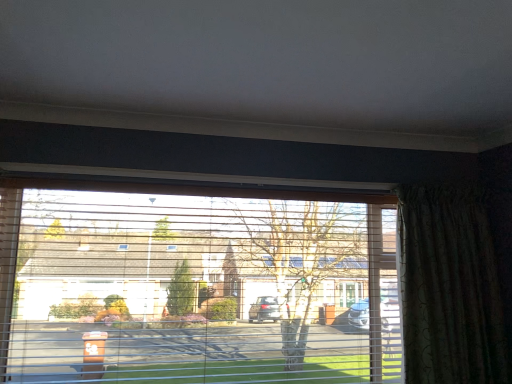
Question: From the image's perspective, is transparent plastic window at center located above green textured curtain at right?

Choices:
 (A) no
 (B) yes

Answer: (A)

Question: Does transparent plastic window at center have a larger size compared to green textured curtain at right?

Choices:
 (A) yes
 (B) no

Answer: (A)

Question: Would you say green textured curtain at right is part of transparent plastic window at center's contents?

Choices:
 (A) no
 (B) yes

Answer: (A)

Question: Is transparent plastic window at center facing away from green textured curtain at right?

Choices:
 (A) yes
 (B) no

Answer: (B)

Question: From a real-world perspective, does transparent plastic window at center stand above green textured curtain at right?

Choices:
 (A) no
 (B) yes

Answer: (A)

Question: Is transparent plastic window at center taller than green textured curtain at right?

Choices:
 (A) no
 (B) yes

Answer: (B)

Question: Is green textured curtain at right not near transparent plastic window at center?

Choices:
 (A) yes
 (B) no

Answer: (B)

Question: From a real-world perspective, is green textured curtain at right below transparent plastic window at center?

Choices:
 (A) no
 (B) yes

Answer: (A)

Question: Can you confirm if green textured curtain at right is positioned to the left of transparent plastic window at center?

Choices:
 (A) yes
 (B) no

Answer: (B)

Question: Considering the relative sizes of green textured curtain at right and transparent plastic window at center in the image provided, is green textured curtain at right thinner than transparent plastic window at center?

Choices:
 (A) yes
 (B) no

Answer: (A)

Question: From the image's perspective, is green textured curtain at right under transparent plastic window at center?

Choices:
 (A) yes
 (B) no

Answer: (B)

Question: Can you confirm if green textured curtain at right is smaller than transparent plastic window at center?

Choices:
 (A) yes
 (B) no

Answer: (A)

Question: Based on their sizes in the image, would you say green textured curtain at right is bigger or smaller than transparent plastic window at center?

Choices:
 (A) big
 (B) small

Answer: (B)